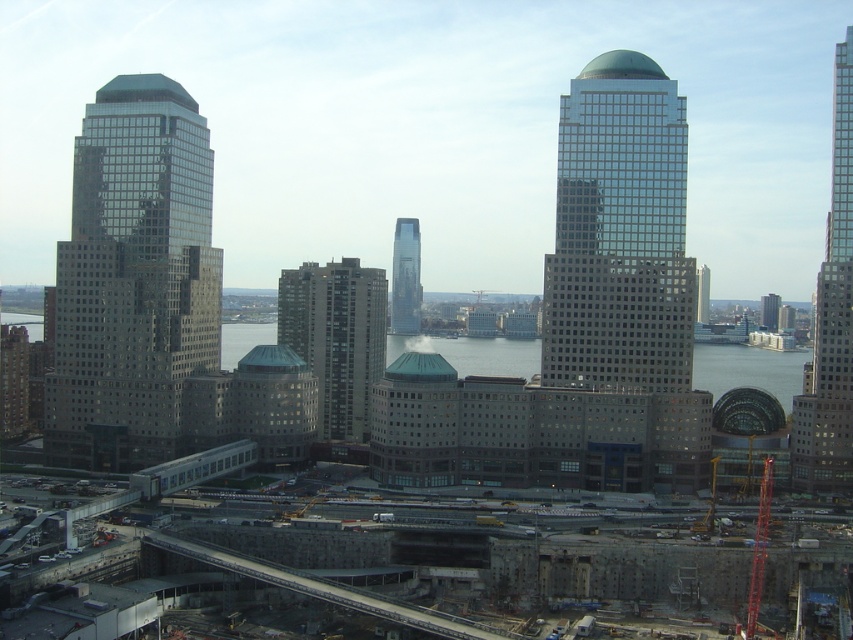
You are a drone operator who needs to deliver a package to the clear glass skyscraper at center. The drone can only fly in a straight line from your current position at point 0.5,0.5. Will the drone have a clear path to the skyscraper?

The clear glass skyscraper at center is located at point (619, 232). Since your current position is at (426, 320), the straight line path between these two points would not be obstructed by any foreground construction elements, so yes, the drone has a clear path.